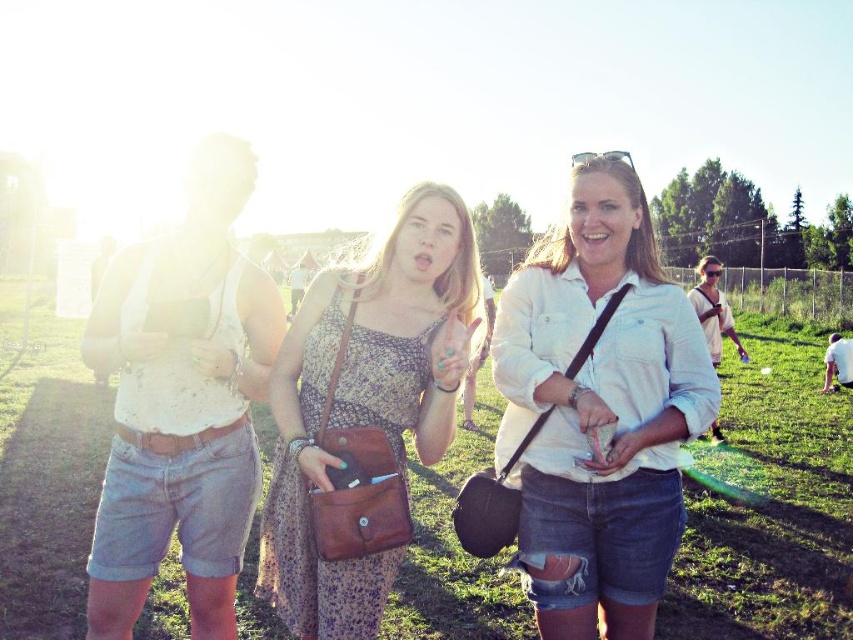
Can you confirm if green grass at center is shorter than leather purse at center?

Indeed, green grass at center has a lesser height compared to leather purse at center.

The image size is (853, 640). I want to click on green grass at center, so click(770, 506).

Where is `green grass at center`? Image resolution: width=853 pixels, height=640 pixels. green grass at center is located at coordinates (770, 506).

Does leather purse at center have a smaller size compared to white cotton tank top at left?

Indeed, leather purse at center has a smaller size compared to white cotton tank top at left.

Does leather purse at center come in front of white cotton tank top at left?

Yes, it is.

Does point (264, 566) lie behind point (144, 492)?

Yes, it is behind point (144, 492).

Locate an element on the screen. leather purse at center is located at coordinates (364, 413).

Is green grass at center shorter than white cotton tank top at left?

Yes, green grass at center is shorter than white cotton tank top at left.

Is green grass at center further to the viewer compared to white cotton tank top at left?

Yes, green grass at center is further from the viewer.

The height and width of the screenshot is (640, 853). What are the coordinates of `green grass at center` in the screenshot? It's located at (770, 506).

Where is `green grass at center`? The width and height of the screenshot is (853, 640). green grass at center is located at coordinates coord(770,506).